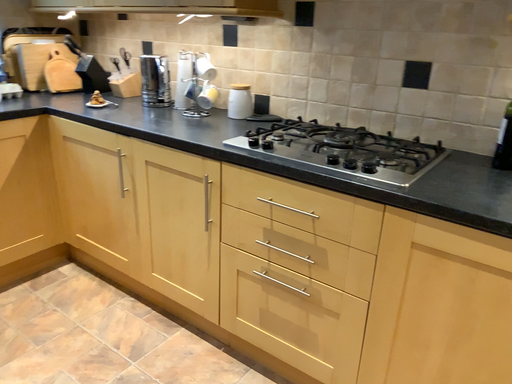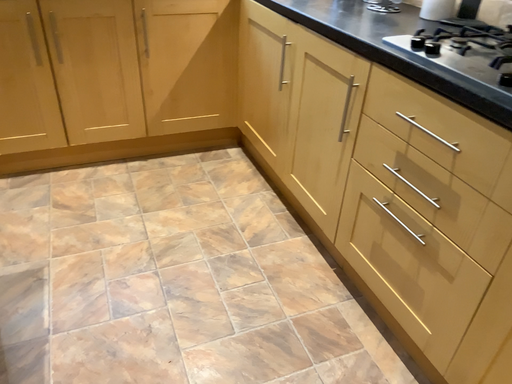
Question: How did the camera likely rotate when shooting the video?

Choices:
 (A) rotated right
 (B) rotated left

Answer: (B)